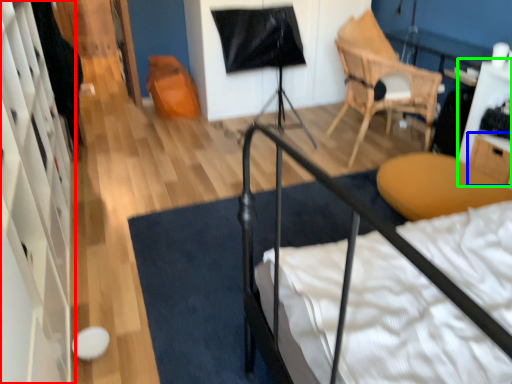
Question: Based on their relative distances, which object is farther from dresser (highlighted by a red box)? Choose from drawer (highlighted by a blue box) and table (highlighted by a green box).

Choices:
 (A) drawer
 (B) table

Answer: (B)